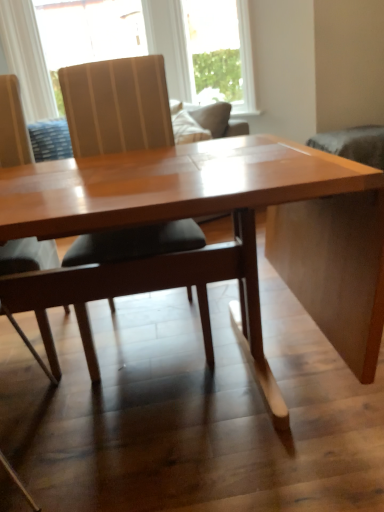
Question: Which direction should I rotate to look at matte wood chair at center, the first chair from the right?

Choices:
 (A) left
 (B) right

Answer: (A)

Question: Does translucent fabric at upper center, the second window in the right-to-left sequence, have a lesser width compared to matte wood chair at left, which ranks as the second chair in right-to-left order?

Choices:
 (A) yes
 (B) no

Answer: (A)

Question: Is translucent fabric at upper center, the first window positioned from the left, further to the viewer compared to matte wood chair at left, the first chair in the left-to-right sequence?

Choices:
 (A) yes
 (B) no

Answer: (A)

Question: Can you see translucent fabric at upper center, the second window in the right-to-left sequence, touching matte wood chair at left, which ranks as the second chair in right-to-left order?

Choices:
 (A) yes
 (B) no

Answer: (B)

Question: Is translucent fabric at upper center, the first window positioned from the left, oriented away from matte wood chair at left, the first chair in the left-to-right sequence?

Choices:
 (A) no
 (B) yes

Answer: (A)

Question: Could you tell me if translucent fabric at upper center, the second window in the right-to-left sequence, is facing matte wood chair at left, which ranks as the second chair in right-to-left order?

Choices:
 (A) no
 (B) yes

Answer: (B)

Question: From the image's perspective, is translucent fabric at upper center, the second window in the right-to-left sequence, under matte wood chair at left, the first chair in the left-to-right sequence?

Choices:
 (A) yes
 (B) no

Answer: (B)

Question: Does translucent fabric at upper center, the first window positioned from the left, have a greater height compared to wooden table at center?

Choices:
 (A) no
 (B) yes

Answer: (B)

Question: From the image's perspective, would you say translucent fabric at upper center, the first window positioned from the left, is positioned over wooden table at center?

Choices:
 (A) yes
 (B) no

Answer: (A)

Question: Is translucent fabric at upper center, the second window in the right-to-left sequence, to the left of wooden table at center from the viewer's perspective?

Choices:
 (A) yes
 (B) no

Answer: (A)

Question: Could you tell me if translucent fabric at upper center, the second window in the right-to-left sequence, is facing wooden table at center?

Choices:
 (A) no
 (B) yes

Answer: (B)

Question: Can you confirm if translucent fabric at upper center, the first window positioned from the left, is smaller than wooden table at center?

Choices:
 (A) yes
 (B) no

Answer: (A)

Question: Would you consider translucent fabric at upper center, the second window in the right-to-left sequence, to be distant from wooden table at center?

Choices:
 (A) yes
 (B) no

Answer: (A)

Question: Is clear glass window at upper center, which is the first window from right to left, shorter than translucent fabric at upper center, the first window positioned from the left?

Choices:
 (A) no
 (B) yes

Answer: (A)